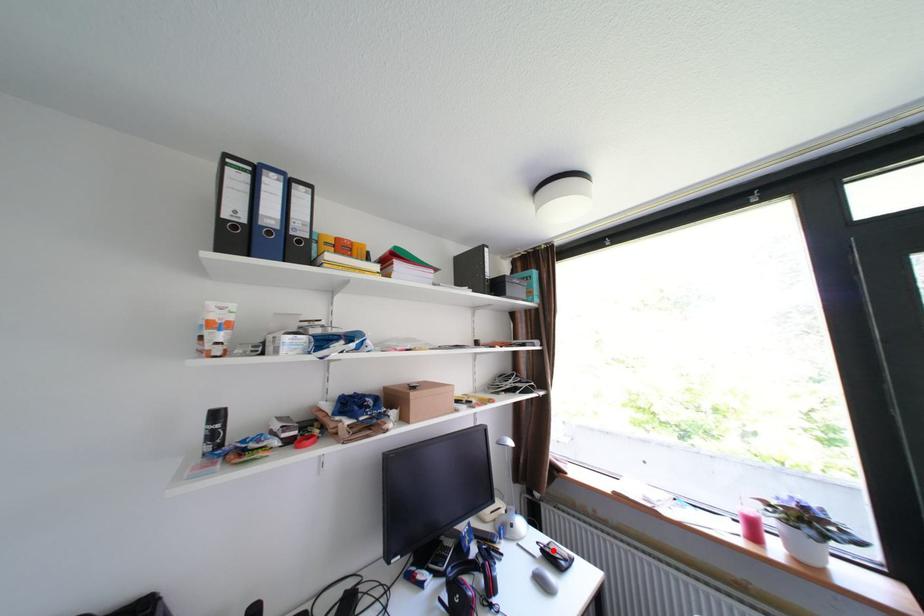
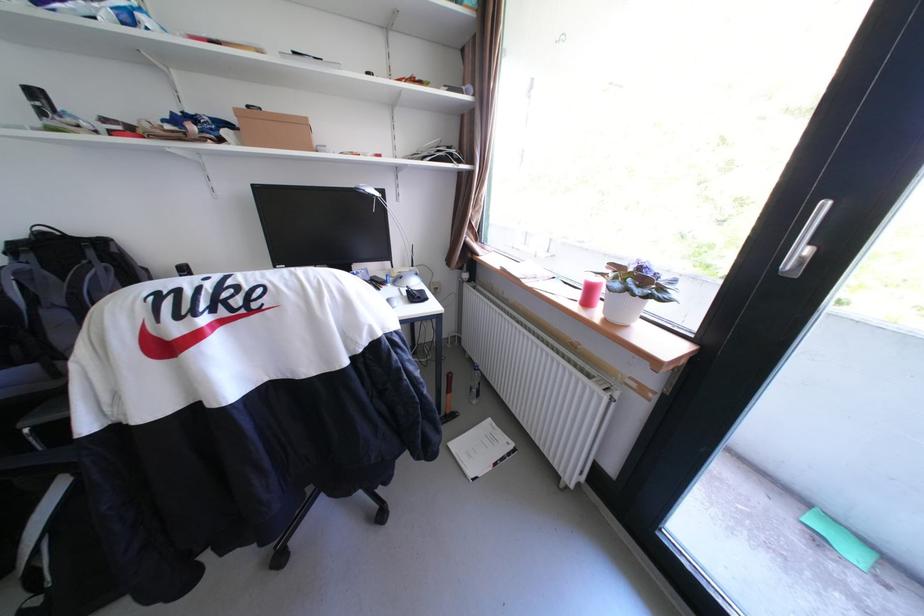
Question: A red point is marked in image1. In image2, is the corresponding 3D point closer to the camera or farther? Reply with the corresponding letter.

Choices:
 (A) The corresponding 3D point is closer.
 (B) The corresponding 3D point is farther.

Answer: (B)